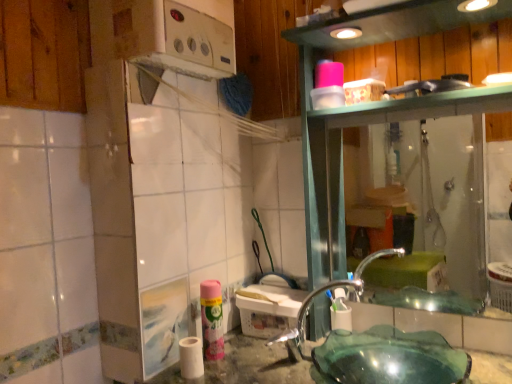
Question: Is point (344, 304) positioned closer to the camera than point (359, 291)?

Choices:
 (A) farther
 (B) closer

Answer: (B)

Question: Is pink matte shaving cream at lower center wider or thinner than clear glass faucet at lower center?

Choices:
 (A) wide
 (B) thin

Answer: (B)

Question: Estimate the real-world distances between objects in this image. Which object is farther from the green glass sink at lower center?

Choices:
 (A) pink matte shaving cream at lower center
 (B) clear glass faucet at lower center
 (C) white matte toilet paper at lower center
 (D) transparent glass shower at right
 (E) pink matte spray can at lower center

Answer: (D)

Question: Which is farther from the pink matte shaving cream at lower center?

Choices:
 (A) white matte toilet paper at lower center
 (B) transparent glass shower at right
 (C) green glass sink at lower center
 (D) pink matte spray can at lower center
 (E) clear glass faucet at lower center

Answer: (B)